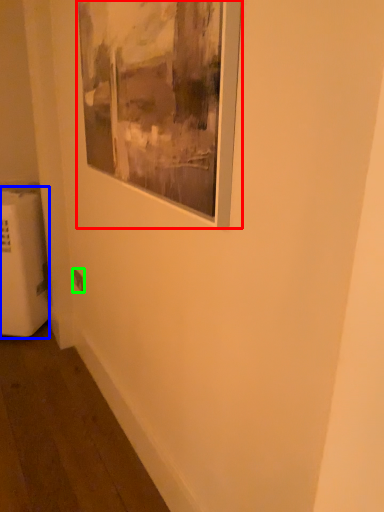
Question: Considering the real-world distances, which object is farthest from picture frame (highlighted by a red box)? radiator (highlighted by a blue box) or electric outlet (highlighted by a green box)?

Choices:
 (A) radiator
 (B) electric outlet

Answer: (A)